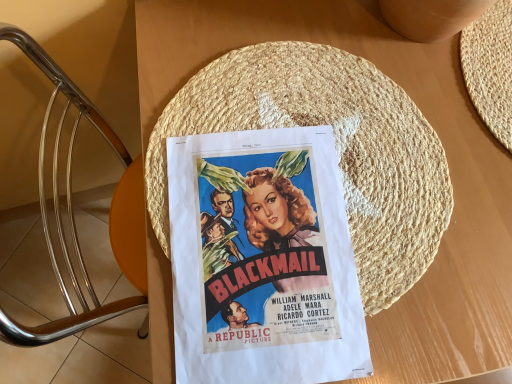
Question: From a real-world perspective, is matte paper poster at center positioned above or below natural straw hat at center?

Choices:
 (A) above
 (B) below

Answer: (A)

Question: Is matte paper poster at center bigger or smaller than natural straw hat at center?

Choices:
 (A) small
 (B) big

Answer: (A)

Question: Which is correct: matte paper poster at center is inside natural straw hat at center, or outside of it?

Choices:
 (A) inside
 (B) outside

Answer: (A)

Question: In terms of height, does natural straw hat at center look taller or shorter compared to matte paper poster at center?

Choices:
 (A) tall
 (B) short

Answer: (B)

Question: From a real-world perspective, relative to matte paper poster at center, is natural straw hat at center vertically above or below?

Choices:
 (A) above
 (B) below

Answer: (B)

Question: Considering the positions of point (334, 137) and point (205, 256), is point (334, 137) closer or farther from the camera than point (205, 256)?

Choices:
 (A) closer
 (B) farther

Answer: (B)

Question: Looking at their shapes, would you say natural straw hat at center is wider or thinner than matte paper poster at center?

Choices:
 (A) thin
 (B) wide

Answer: (B)